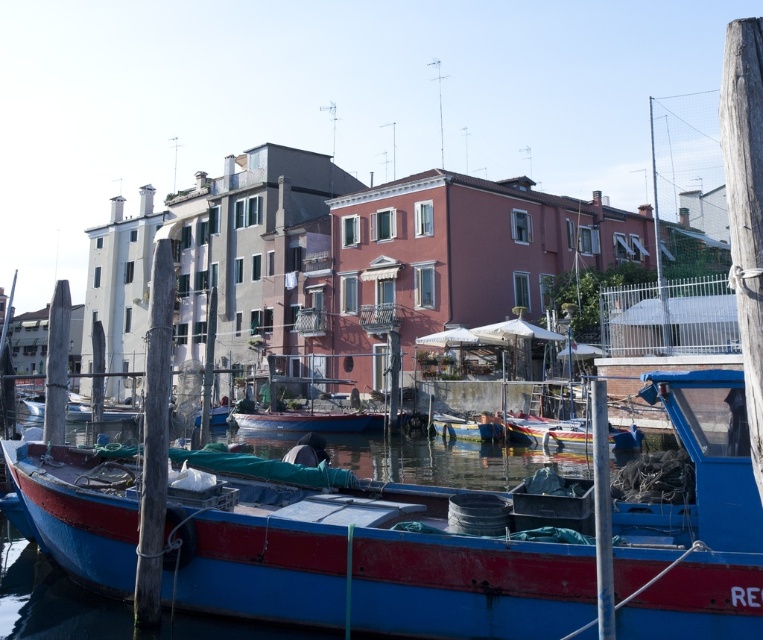
Question: Is blue matte boat at lower left thinner than blue glossy boat at center?

Choices:
 (A) no
 (B) yes

Answer: (A)

Question: Which point is farther from the camera taking this photo?

Choices:
 (A) (477, 586)
 (B) (298, 420)

Answer: (B)

Question: Considering the relative positions of blue matte boat at lower left and blue glossy boat at center in the image provided, where is blue matte boat at lower left located with respect to blue glossy boat at center?

Choices:
 (A) below
 (B) above

Answer: (B)

Question: Which point is closer to the camera?

Choices:
 (A) (306, 529)
 (B) (288, 417)

Answer: (A)

Question: Among these points, which one is farthest from the camera?

Choices:
 (A) (330, 422)
 (B) (517, 509)

Answer: (A)

Question: Can you confirm if blue matte boat at lower left is positioned to the left of blue glossy boat at center?

Choices:
 (A) no
 (B) yes

Answer: (A)